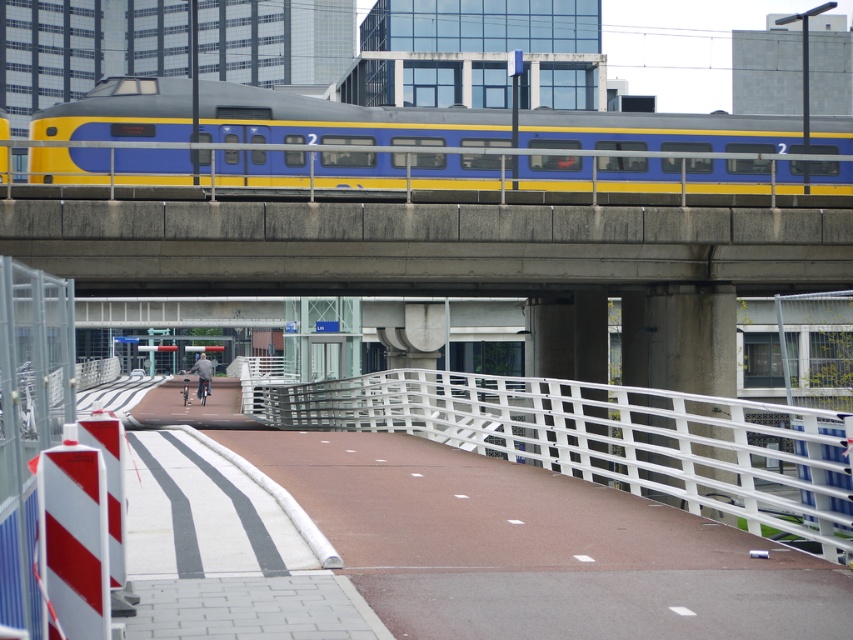
Can you confirm if yellow-blue painted train at upper center is positioned above white metallic rail at center?

Correct, yellow-blue painted train at upper center is located above white metallic rail at center.

Can you confirm if yellow-blue painted train at upper center is bigger than white metallic rail at center?

No, yellow-blue painted train at upper center is not bigger than white metallic rail at center.

The height and width of the screenshot is (640, 853). I want to click on yellow-blue painted train at upper center, so click(486, 147).

The height and width of the screenshot is (640, 853). Identify the location of yellow-blue painted train at upper center. (486, 147).